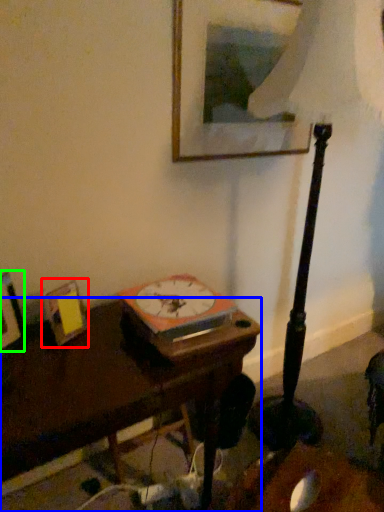
Question: Which is nearer to the picture frame (highlighted by a red box)? table (highlighted by a blue box) or picture frame (highlighted by a green box).

Choices:
 (A) table
 (B) picture frame

Answer: (B)